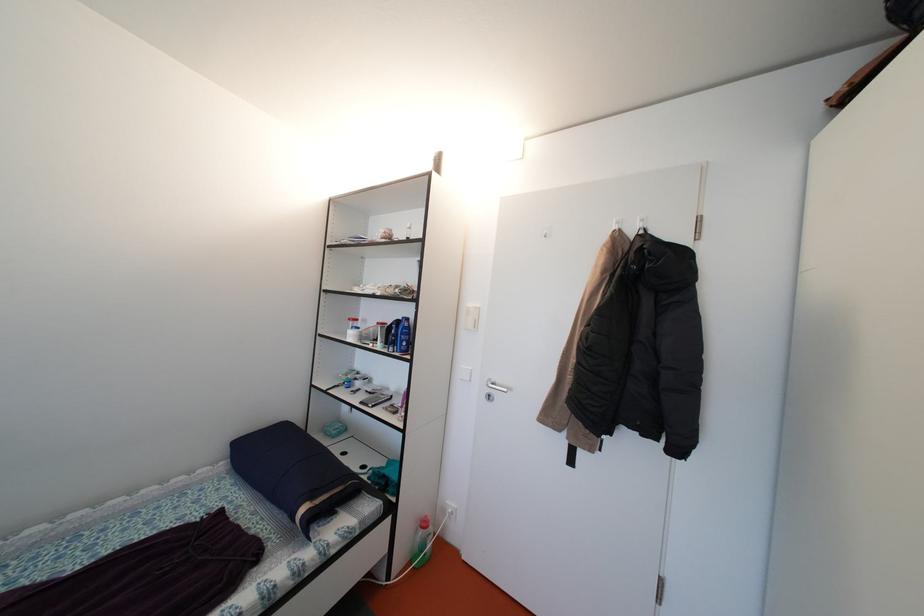
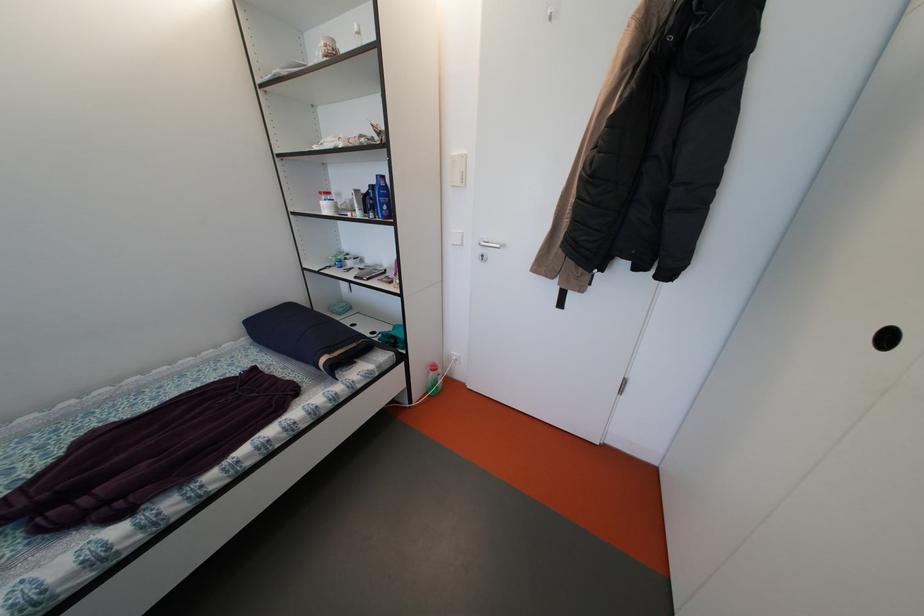
Where in the second image is the point corresponding to point 432,529 from the first image?

(441, 373)